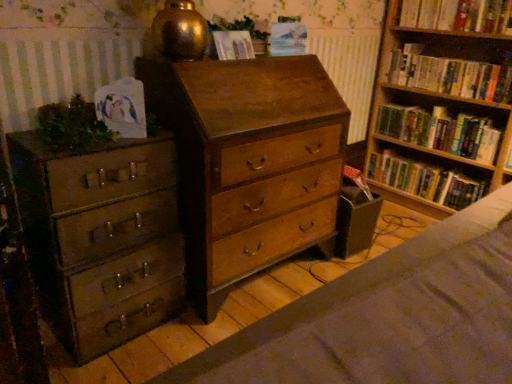
At what (x,y) coordinates should I click in order to perform the action: click on vacant space in green matte plant at left, arranged as the 1th plant when ordered from the bottom (from a real-world perspective). Please return your answer as a coordinate pair (x, y). Looking at the image, I should click on (73, 142).